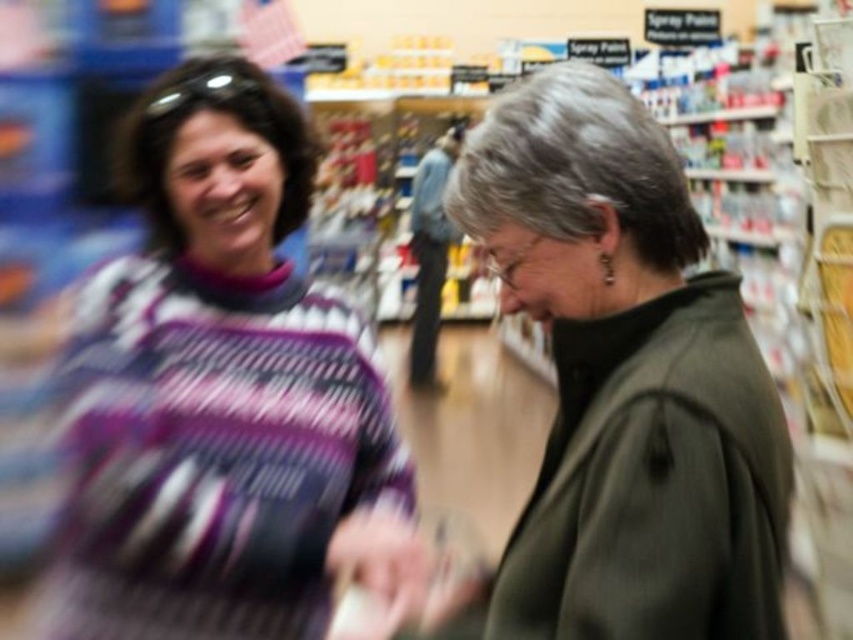
You are a store employee who needs to determine which clothing item is bigger between the purple knitted sweater at left and the dark green jacket at center. Which one should you inform customers about?

The purple knitted sweater at left has a larger size compared to the dark green jacket at center, so customers should be informed that the purple knitted sweater at left is bigger.

Based on the photo, you are a store employee who needs to guide a customer to the Spray Paint section. The customer is wearing a purple knitted sweater at left and a dark green jacket at center. Which piece of clothing is closer to the floor?

The purple knitted sweater at left is located below the dark green jacket at center, so it is closer to the floor.